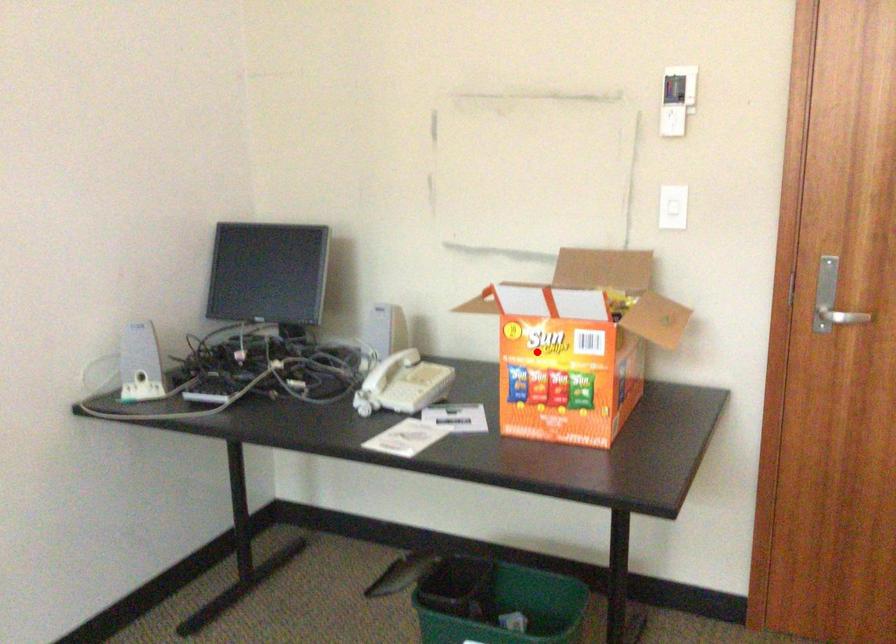
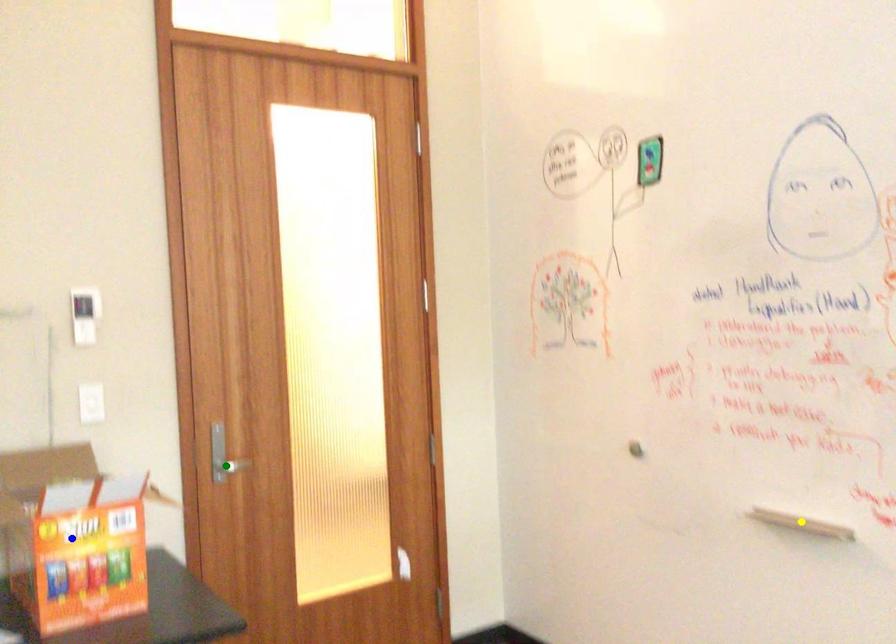
Question: I am providing you with two images of the same scene from different viewpoints. A red point is marked on the first image. You are given multiple points on the second image. Which point in image 2 is actually the same real-world point as the red point in image 1?

Choices:
 (A) blue point
 (B) green point
 (C) yellow point

Answer: (A)